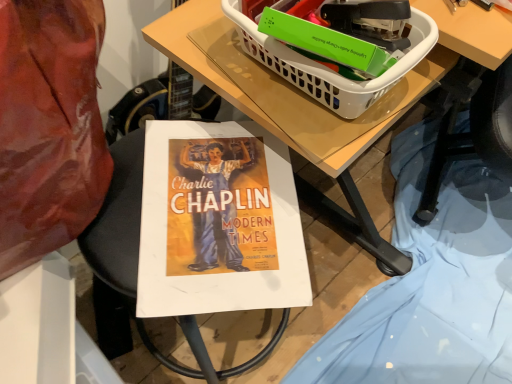
Question: Would you say white plastic basket at upper right is to the left or to the right of wooden table at center in the picture?

Choices:
 (A) right
 (B) left

Answer: (B)

Question: Based on their sizes in the image, would you say white plastic basket at upper right is bigger or smaller than wooden table at center?

Choices:
 (A) small
 (B) big

Answer: (A)

Question: Relative to wooden table at center, is white plastic basket at upper right in front or behind?

Choices:
 (A) front
 (B) behind

Answer: (A)

Question: Is wooden table at center to the left or to the right of white plastic basket at upper right in the image?

Choices:
 (A) left
 (B) right

Answer: (B)

Question: In terms of height, does wooden table at center look taller or shorter compared to white plastic basket at upper right?

Choices:
 (A) short
 (B) tall

Answer: (A)

Question: Is wooden table at center inside or outside of white plastic basket at upper right?

Choices:
 (A) outside
 (B) inside

Answer: (A)

Question: Considering the positions of wooden table at center and white plastic basket at upper right in the image, is wooden table at center wider or thinner than white plastic basket at upper right?

Choices:
 (A) thin
 (B) wide

Answer: (B)